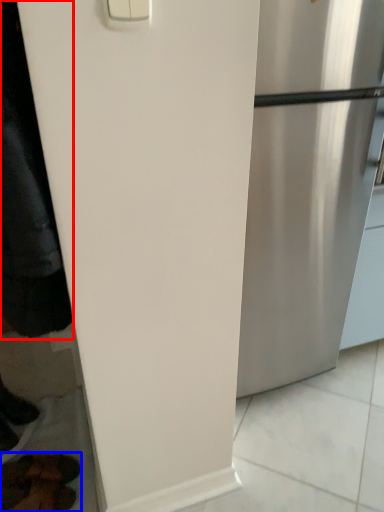
Question: Which object is closer to the camera taking this photo, jacket (highlighted by a red box) or footwear (highlighted by a blue box)?

Choices:
 (A) jacket
 (B) footwear

Answer: (A)